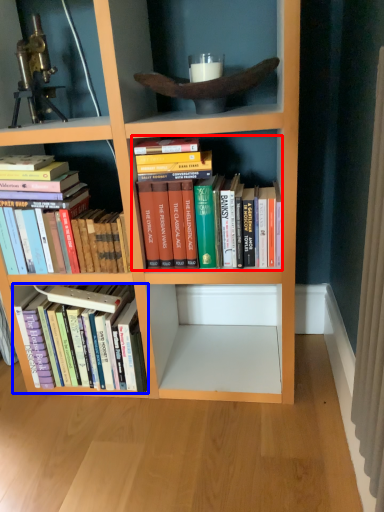
Question: Which object is further to the camera taking this photo, book (highlighted by a red box) or book (highlighted by a blue box)?

Choices:
 (A) book
 (B) book

Answer: (B)